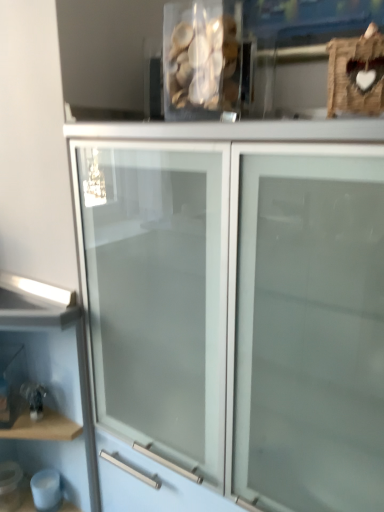
Question: In the image, is wooden shelf at lower left positioned in front of or behind translucent plastic container at upper center?

Choices:
 (A) front
 (B) behind

Answer: (B)

Question: From a real-world perspective, relative to translucent plastic container at upper center, is wooden shelf at lower left vertically above or below?

Choices:
 (A) below
 (B) above

Answer: (A)

Question: Estimate the real-world distances between objects in this image. Which object is farther from the translucent plastic container at upper center?

Choices:
 (A) wooden shelf at lower left
 (B) white frosted glass cabinet at center

Answer: (A)

Question: Based on their relative distances, which object is farther from the translucent plastic container at upper center?

Choices:
 (A) wooden shelf at lower left
 (B) white frosted glass cabinet at center

Answer: (A)